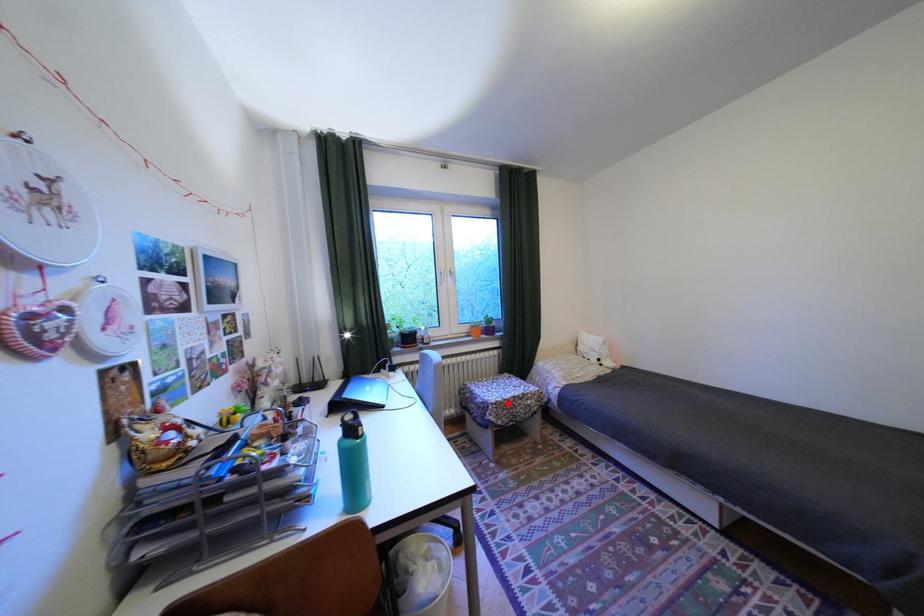
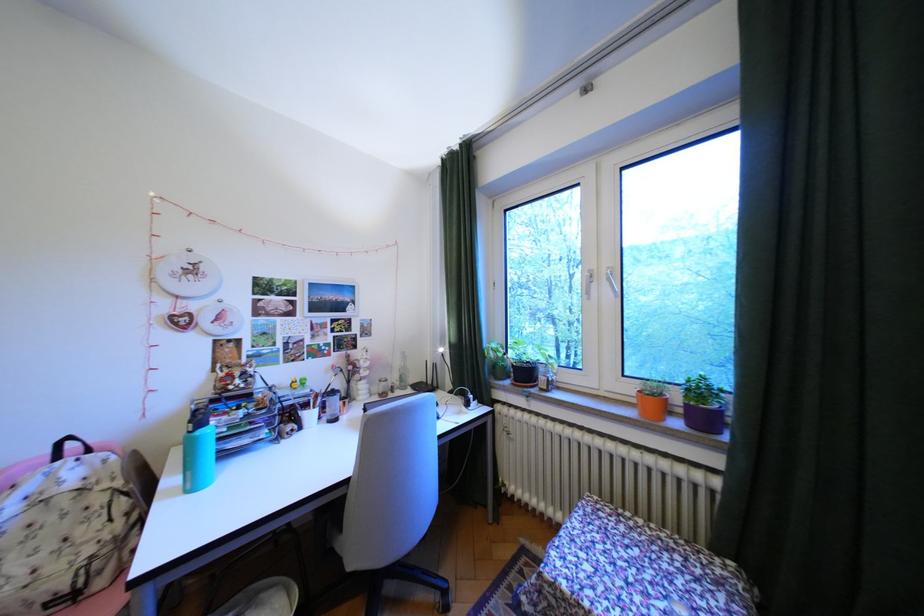
Question: I am providing you with two images of the same scene from different viewpoints. A red point is marked on the first image. Is the red point's position out of view in image 2?

Choices:
 (A) Yes
 (B) No

Answer: (B)